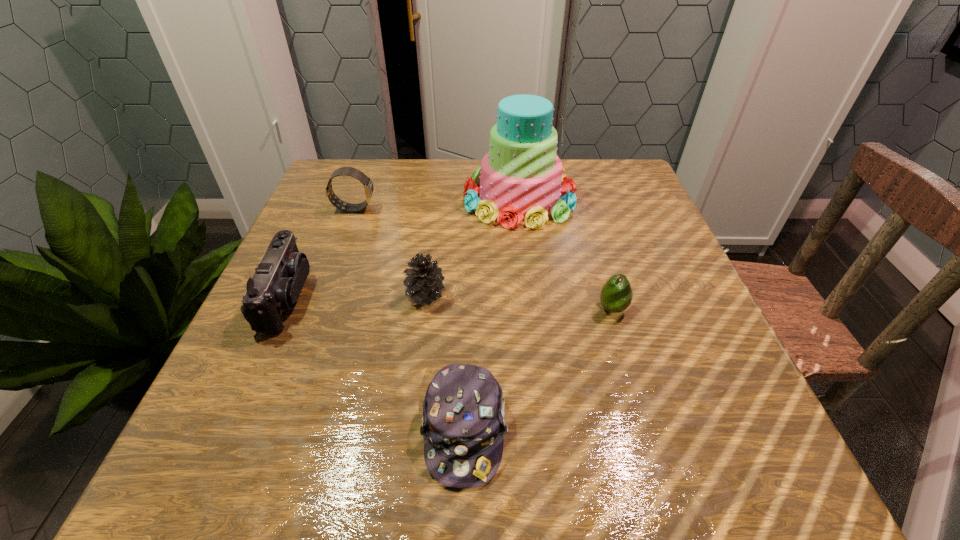
The image size is (960, 540). In order to click on vacant space that satisfies the following two spatial constraints: 1. on the face of the watch; 2. on the right side of the avocado in this screenshot , I will do (317, 309).

Find the location of a particular element. This screenshot has width=960, height=540. free space that satisfies the following two spatial constraints: 1. on the back side of the avocado; 2. on the face of the watch is located at coordinates (583, 208).

At what (x,y) coordinates should I click in order to perform the action: click on free space that satisfies the following two spatial constraints: 1. on the front-facing side of the avocado; 2. on the left side of the camcorder. Please return your answer as a coordinate pair (x, y). This screenshot has height=540, width=960. Looking at the image, I should click on (281, 309).

Identify the location of free space that satisfies the following two spatial constraints: 1. on the face of the pinecone; 2. on the left side of the watch. (323, 295).